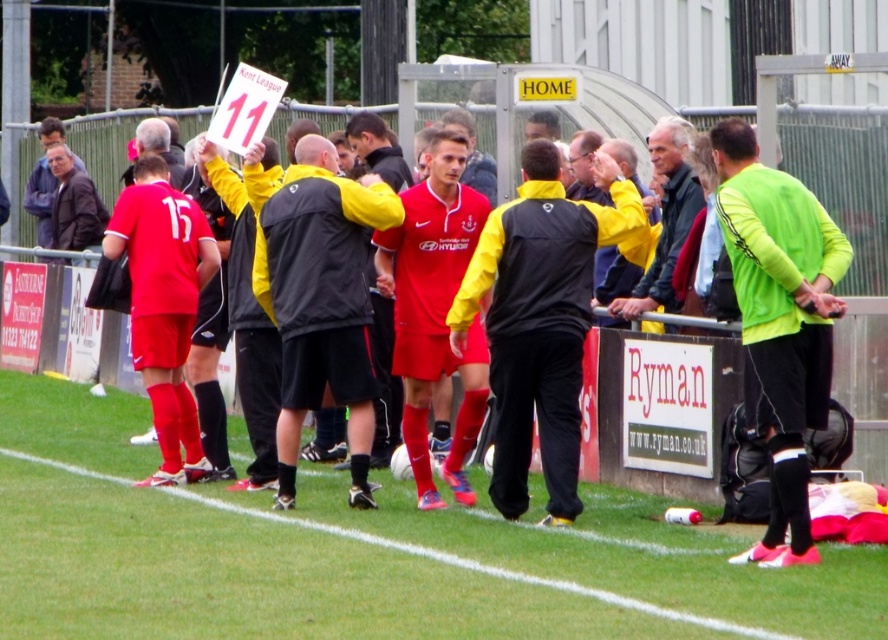
You are a photographer trying to capture a closeup shot of the black matte jacket at center and the brown leather jacket at upper left. Since you have a limited frame, which jacket should you focus on to ensure it fits within the frame first?

The black matte jacket at center is wider than the brown leather jacket at upper left, so you should focus on capturing the black matte jacket at center first to ensure it fits within the frame.

You are a photographer standing at the sidelines of a football field. You want to take a closeup photo of the neon green jersey at center. Considering the distance, can you capture it clearly with a standard camera lens that has a maximum zoom range of 100mm?

The neon green jersey at center is 32.12 feet from the camera. A standard camera lens with a maximum zoom of 100mm can typically capture clear images up to approximately 30 feet. Since the distance is slightly beyond this range, the jersey may appear slightly blurry unless additional zoom or a telephoto lens is used.